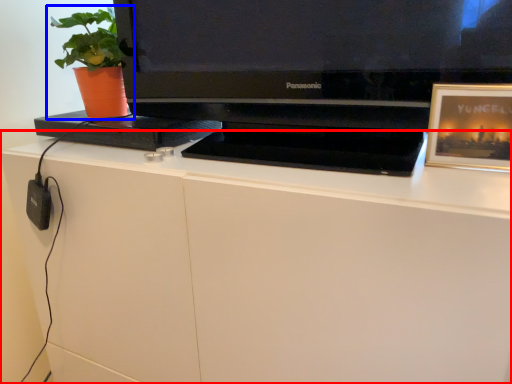
Question: Which point is further to the camera, desk (highlighted by a red box) or houseplant (highlighted by a blue box)?

Choices:
 (A) desk
 (B) houseplant

Answer: (B)